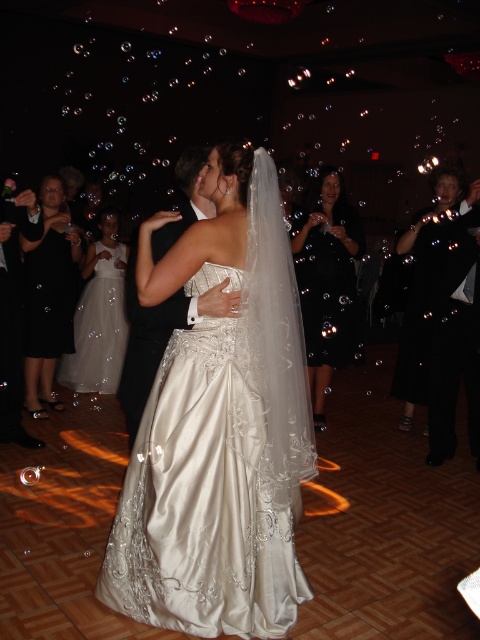
You are a photographer at the wedding reception. You need to capture a photo of the black satin dress at left and the white satin dress at center. Based on their positions, which dress is higher in the frame?

The black satin dress at left is above the white satin dress at center in the frame.